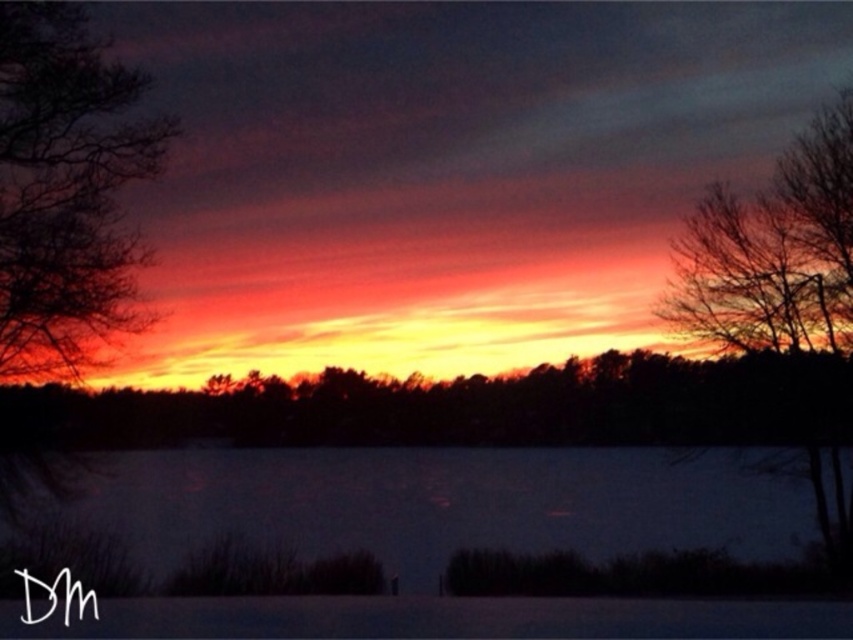
Question: Which point is closer to the camera taking this photo?

Choices:
 (A) (722, 273)
 (B) (68, 8)

Answer: (B)

Question: Is silhouette bare tree at left thinner than silhouette bare tree at right?

Choices:
 (A) yes
 (B) no

Answer: (B)

Question: Which point is farther to the camera?

Choices:
 (A) silhouette bare tree at right
 (B) silhouette bare tree at left

Answer: (A)

Question: Does silhouette bare tree at left appear over silhouette bare tree at right?

Choices:
 (A) no
 (B) yes

Answer: (B)

Question: Where is silhouette bare tree at left located in relation to silhouette bare tree at right in the image?

Choices:
 (A) left
 (B) right

Answer: (A)